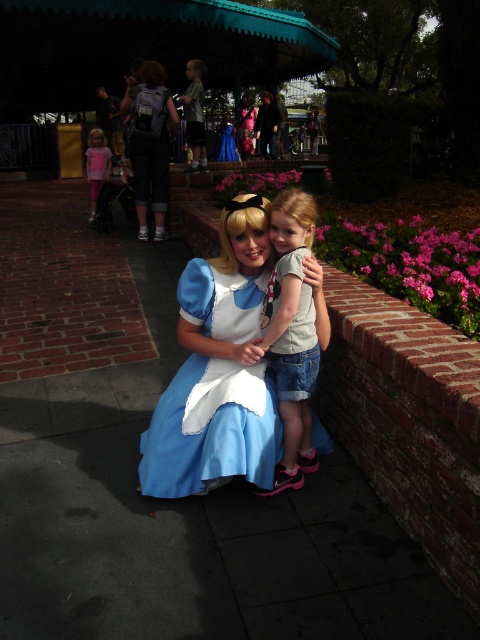
Question: Which of the following is the closest to the observer?

Choices:
 (A) matte black backpack at upper center
 (B) pink cotton shirt at left
 (C) blue satin dress at center

Answer: (C)

Question: Does matte black backpack at upper center appear over pink cotton shirt at left?

Choices:
 (A) yes
 (B) no

Answer: (A)

Question: Which point is closer to the camera?

Choices:
 (A) (92, 182)
 (B) (160, 125)

Answer: (B)

Question: Does denim shorts at center have a lesser width compared to matte black backpack at upper center?

Choices:
 (A) yes
 (B) no

Answer: (A)

Question: Is matte black backpack at upper center below pink cotton shirt at left?

Choices:
 (A) no
 (B) yes

Answer: (A)

Question: Which point is farther from the camera taking this photo?

Choices:
 (A) (156, 65)
 (B) (295, 474)
 (C) (97, 138)
 (D) (177, 428)

Answer: (C)